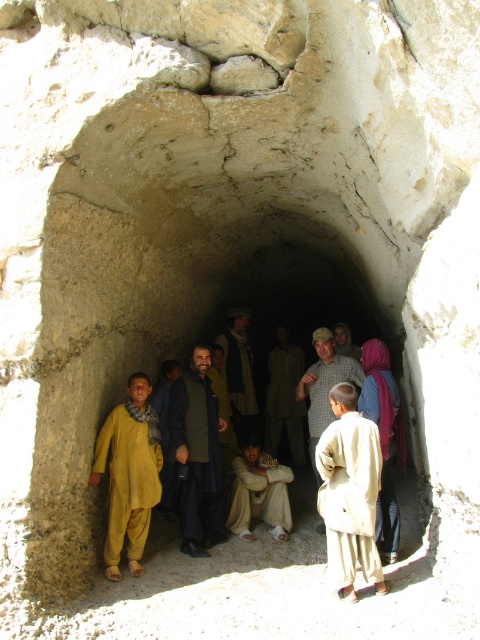
Question: Which is nearer to the light beige fabric robe at center?

Choices:
 (A) checkered fabric shirt at center
 (B) dark green woolen coat at center
 (C) light beige cotton robe at center
 (D) yellow cotton robe at center

Answer: (B)

Question: Which point is closer to the camera taking this photo?

Choices:
 (A) (283, 396)
 (B) (136, 472)
 (C) (282, 492)

Answer: (B)

Question: Observing the image, what is the correct spatial positioning of yellow cotton robe at center in reference to dark brown woolen jacket at center?

Choices:
 (A) above
 (B) below

Answer: (B)

Question: Can you confirm if dark green woolen coat at center is wider than yellow cotton robe at center?

Choices:
 (A) no
 (B) yes

Answer: (B)

Question: Estimate the real-world distances between objects in this image. Which object is closer to the checkered fabric shirt at center?

Choices:
 (A) yellow cotton robe at center
 (B) light purple fabric at center
 (C) dark brown woolen coat at center
 (D) light beige cotton robe at center

Answer: (B)

Question: Does light beige cotton robe at center appear on the right side of dark brown woolen coat at center?

Choices:
 (A) yes
 (B) no

Answer: (B)